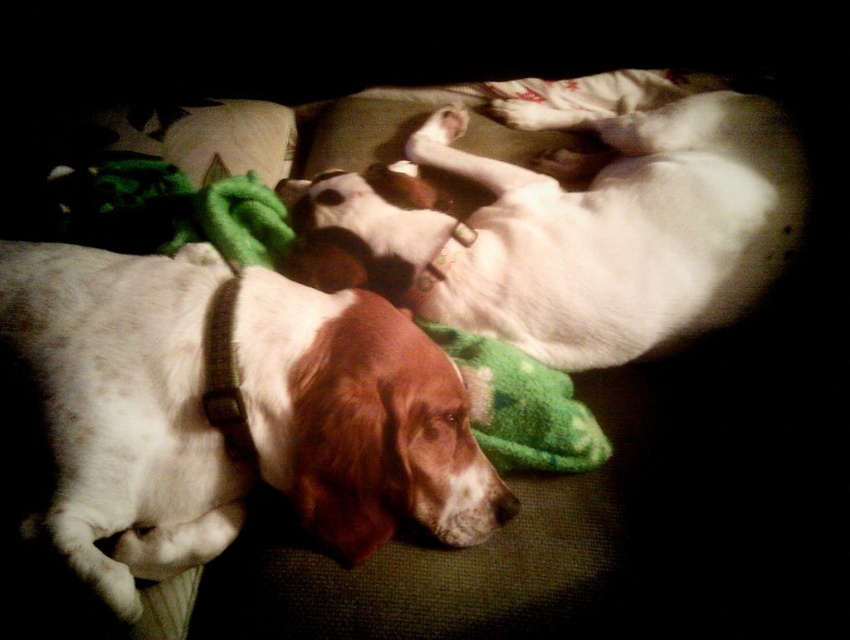
You are observing two dogs on a couch. You need to locate the white fur dog at center. Based on the coordinates provided in the description, can you determine if it is positioned closer to the left or right side of the couch?

The white fur dog at center is located at coordinates point (244, 412). Since the x coordinate is 0.644, which is closer to 1.0, the right side of the couch, the white fur dog at center is positioned closer to the right side of the couch.

You are a dog groomer observing two dogs on a couch. You need to determine their sizes based on their positions. Which dog is shorter in height between the white fur dog at center and the white fur dog at upper center?

The white fur dog at center is shorter in height than the white fur dog at upper center because the description states that the white fur dog at center is not as tall as the white fur dog at upper center.